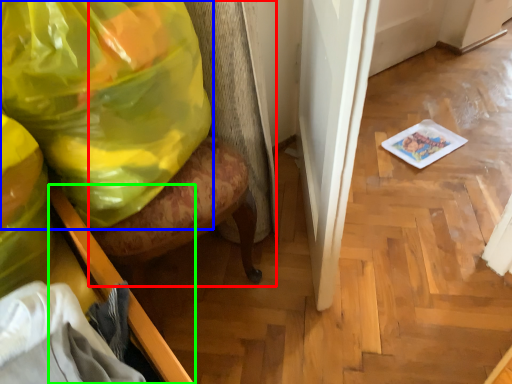
Question: Considering the real-world distances, which object is farthest from swivel chair (highlighted by a red box)? plastic bag (highlighted by a blue box) or furniture (highlighted by a green box)?

Choices:
 (A) plastic bag
 (B) furniture

Answer: (B)